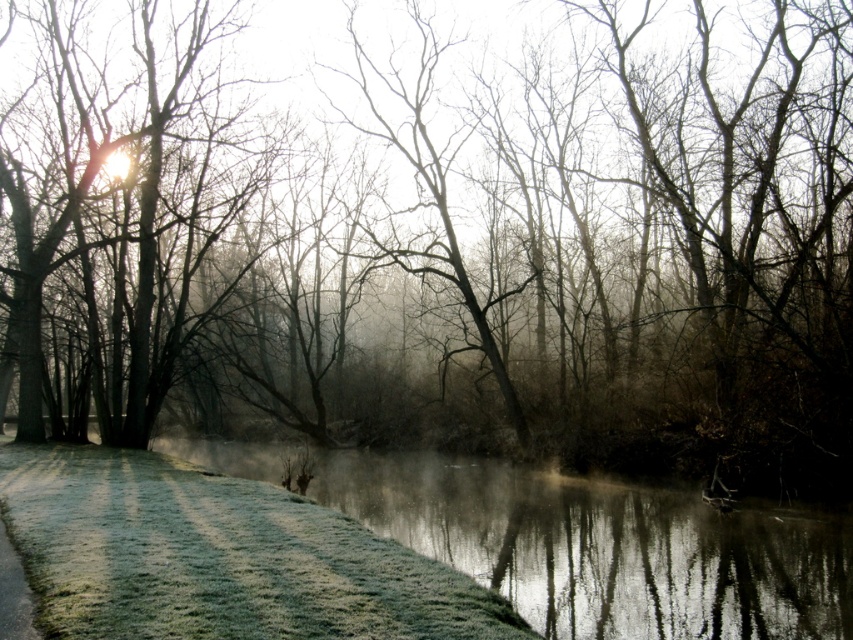
Does frosted glass river at lower center have a lesser width compared to green frosty grass at lower left?

No.

Which is more to the left, frosted glass river at lower center or green frosty grass at lower left?

From the viewer's perspective, green frosty grass at lower left appears more on the left side.

This screenshot has width=853, height=640. What do you see at coordinates (604, 547) in the screenshot?
I see `frosted glass river at lower center` at bounding box center [604, 547].

This screenshot has height=640, width=853. I want to click on frosted glass river at lower center, so click(604, 547).